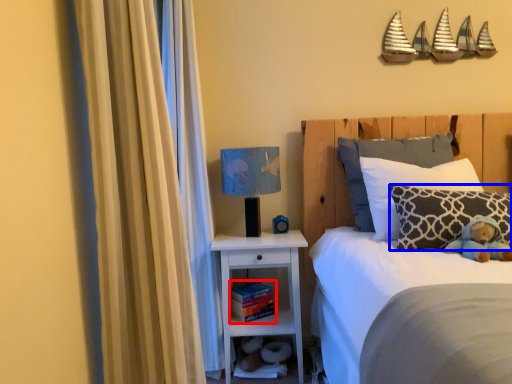
Question: Which point is closer to the camera, book (highlighted by a red box) or pillow (highlighted by a blue box)?

Choices:
 (A) book
 (B) pillow

Answer: (B)